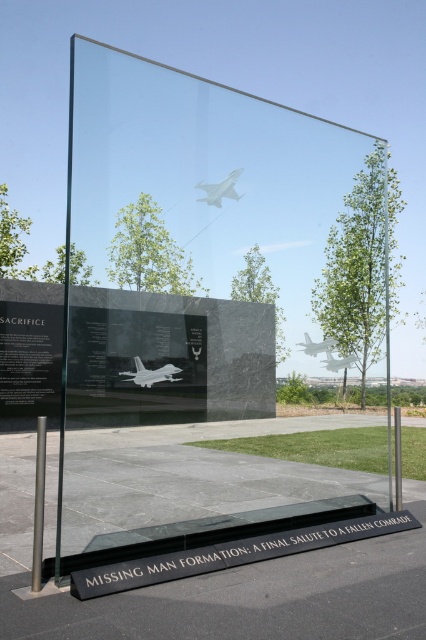
You are a photographer positioned to the left of the transparent glass box at center and the white glossy airplane at center. Which object is closer to your current position?

The transparent glass box at center is closer to your current position because it is positioned to the left of the white glossy airplane at center, meaning it is nearer to the photographer standing on the left side.

You are a photographer positioned to the right of the memorial display. You want to capture both the metallic silver jet at center and the white glossy airplane at center in a single frame. Which object should you adjust your camera angle to include first?

The metallic silver jet at center is to the left of white glossy airplane at center, so you should adjust your camera angle to include the metallic silver jet at center first since it is positioned further left and might be partially out of frame from your rightward position.

You are an architect designing a new memorial layout. You need to ensure that the metallic silver jet at center and the white glossy airplane at center are positioned in a way that their relationship in height is maintained as per the original image. Which one should be placed higher?

The metallic silver jet at center should be placed higher than the white glossy airplane at center because the original image shows the metallic silver jet at center is above white glossy airplane at center.